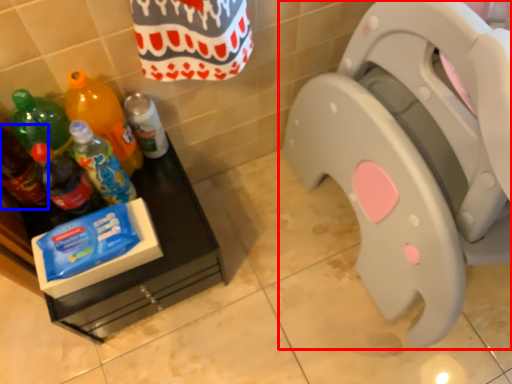
Question: Among these objects, which one is farthest to the camera, toilet (highlighted by a red box) or bottle (highlighted by a blue box)?

Choices:
 (A) toilet
 (B) bottle

Answer: (B)